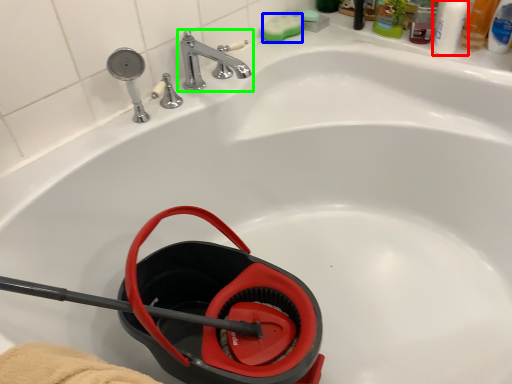
Question: Considering the real-world distances, which object is farthest from mouthwash (highlighted by a red box)? soap (highlighted by a blue box) or tap (highlighted by a green box)?

Choices:
 (A) soap
 (B) tap

Answer: (B)